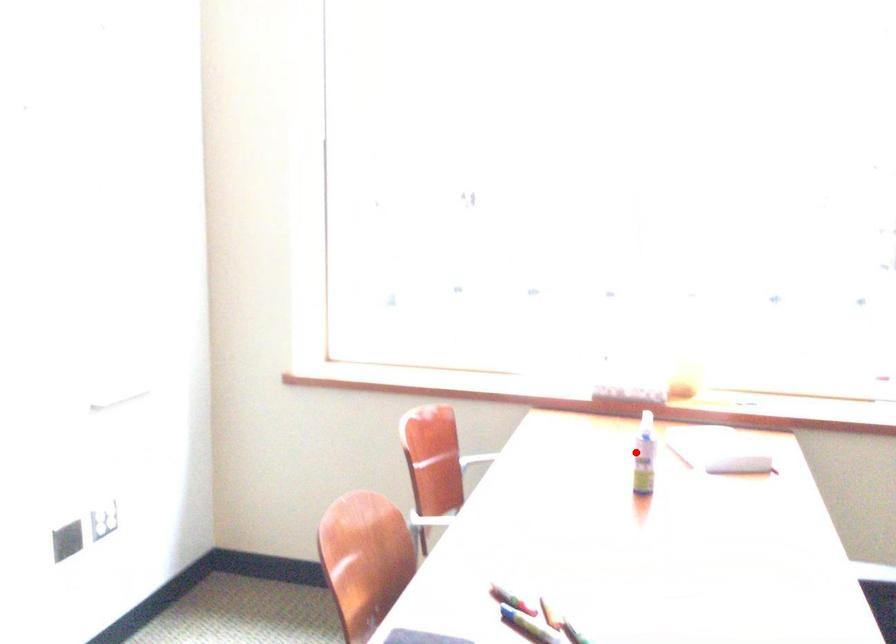
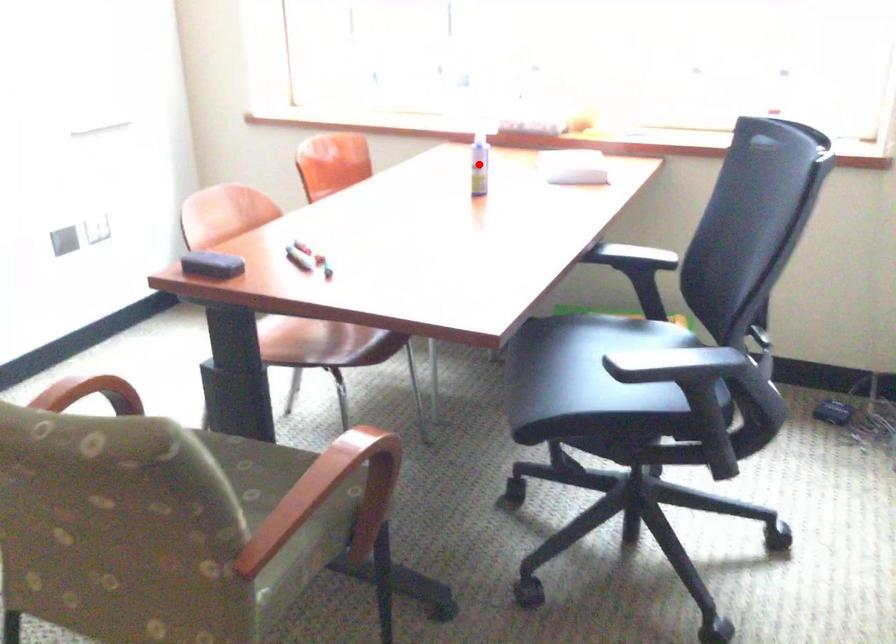
I am providing you with two images of the same scene from different viewpoints. A red point is marked on the first image and another point is marked on the second image. Does the point marked in image1 correspond to the same location as the one in image2?

Yes